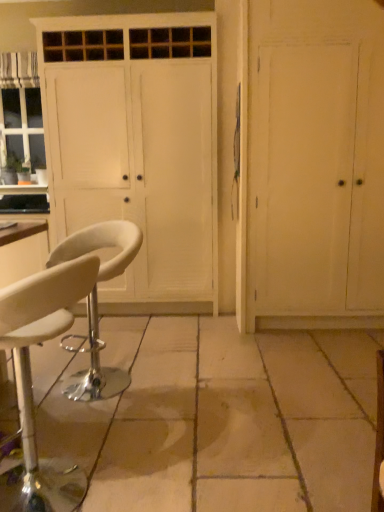
At what (x,y) coordinates should I click in order to perform the action: click on vacant space underneath white leather stool at lower left, the first chair when ordered from back to front (from a real-world perspective). Please return your answer as a coordinate pair (x, y). Looking at the image, I should click on (106, 380).